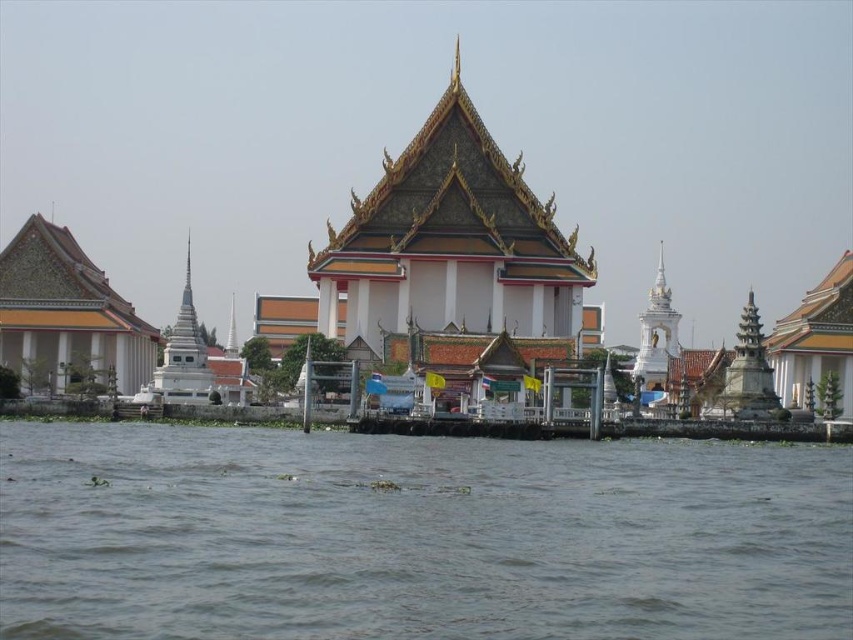
Question: Which point appears closest to the camera in this image?

Choices:
 (A) (611, 476)
 (B) (409, 248)

Answer: (A)

Question: Can you confirm if white stone temple at center is wider than brown murky water at lower center?

Choices:
 (A) no
 (B) yes

Answer: (B)

Question: Which point is closer to the camera?

Choices:
 (A) white stone temple at center
 (B) brown murky water at lower center

Answer: (B)

Question: Can you confirm if white stone temple at center is positioned above brown murky water at lower center?

Choices:
 (A) yes
 (B) no

Answer: (A)

Question: From the image, what is the correct spatial relationship of white stone temple at center in relation to brown murky water at lower center?

Choices:
 (A) above
 (B) below

Answer: (A)

Question: Which of the following is the farthest from the observer?

Choices:
 (A) (795, 204)
 (B) (578, 563)

Answer: (A)